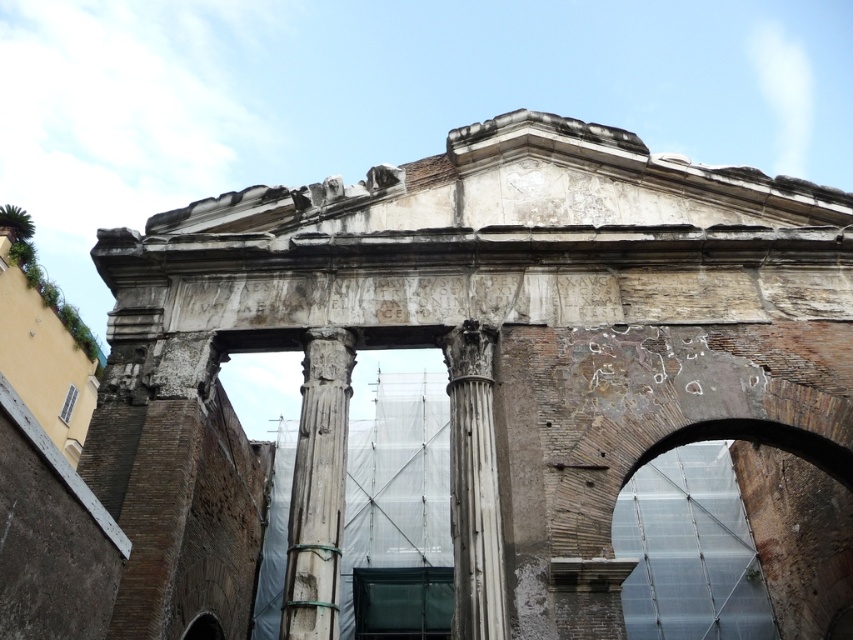
Question: Is rusty metal arch at center to the right of white stone column at center from the viewer's perspective?

Choices:
 (A) yes
 (B) no

Answer: (A)

Question: Which point is farther from the camera taking this photo?

Choices:
 (A) (776, 492)
 (B) (498, 525)

Answer: (A)

Question: Which point is farther to the camera?

Choices:
 (A) (331, 604)
 (B) (445, 387)

Answer: (B)

Question: Among these points, which one is farthest from the camera?

Choices:
 (A) (637, 516)
 (B) (453, 401)

Answer: (A)

Question: Does rusty metal arch at center appear over white stone column at center?

Choices:
 (A) no
 (B) yes

Answer: (A)

Question: Does white stone column at center appear on the left side of white marble column at center?

Choices:
 (A) yes
 (B) no

Answer: (A)